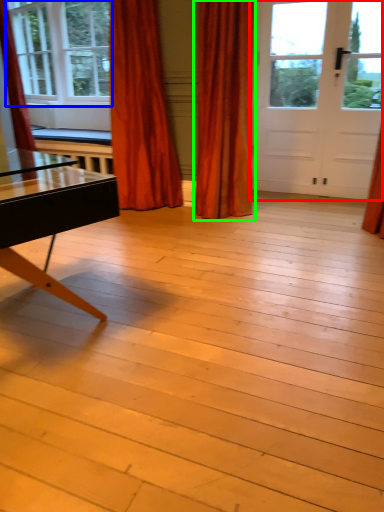
Question: Which is nearer to the door (highlighted by a red box)? window (highlighted by a blue box) or curtain (highlighted by a green box).

Choices:
 (A) window
 (B) curtain

Answer: (B)